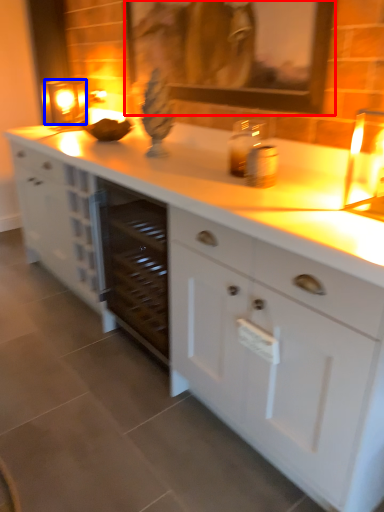
Question: Among these objects, which one is nearest to the camera, picture frame (highlighted by a red box) or candle holder (highlighted by a blue box)?

Choices:
 (A) picture frame
 (B) candle holder

Answer: (A)